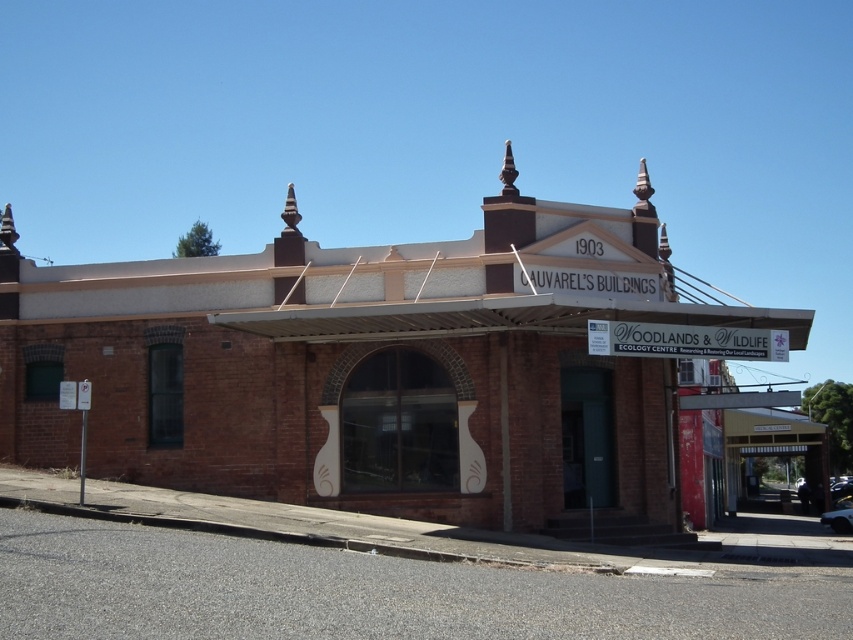
Question: Among these objects, which one is farthest from the camera?

Choices:
 (A) brown wooden canopy at lower right
 (B) brown brick building at center

Answer: (A)

Question: Does brown brick building at center have a lesser width compared to brown wooden canopy at lower right?

Choices:
 (A) no
 (B) yes

Answer: (A)

Question: Observing the image, what is the correct spatial positioning of brown brick building at center in reference to brown wooden canopy at lower right?

Choices:
 (A) left
 (B) right

Answer: (A)

Question: Considering the relative positions of brown brick building at center and brown wooden canopy at lower right in the image provided, where is brown brick building at center located with respect to brown wooden canopy at lower right?

Choices:
 (A) below
 (B) above

Answer: (B)